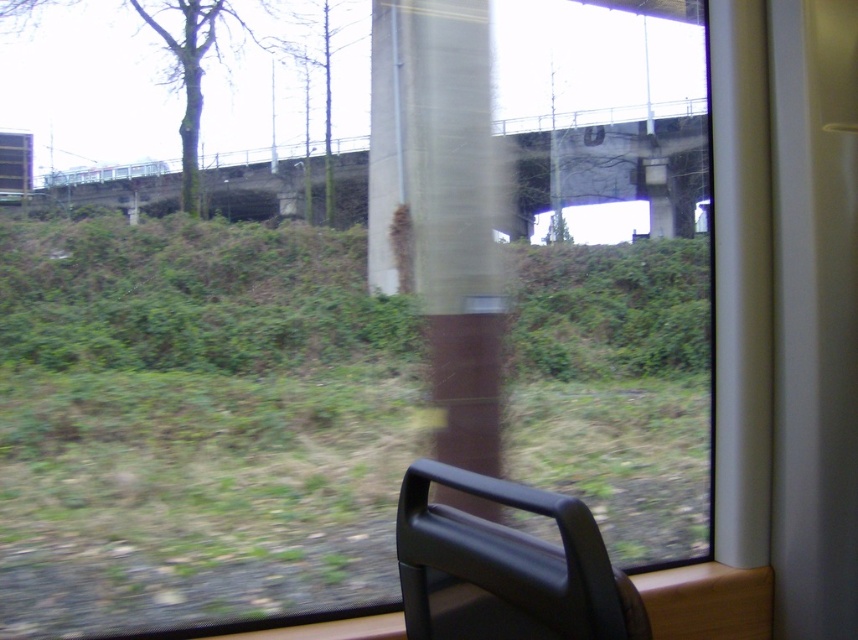
From the picture: You are sitting in a train seat and want to know if the concrete bridge at center is bigger than the black matte chair at lower right. Can you confirm this based on your view?

The concrete bridge at center is larger in size than the black matte chair at lower right, so yes, the concrete bridge at center is bigger than the black matte chair at lower right.

You are sitting on the train seat and want to estimate how far the brown textured pillar at center is from you. Based on the scene, can you determine the distance?

The brown textured pillar at center is 4.02 feet away from the viewer.